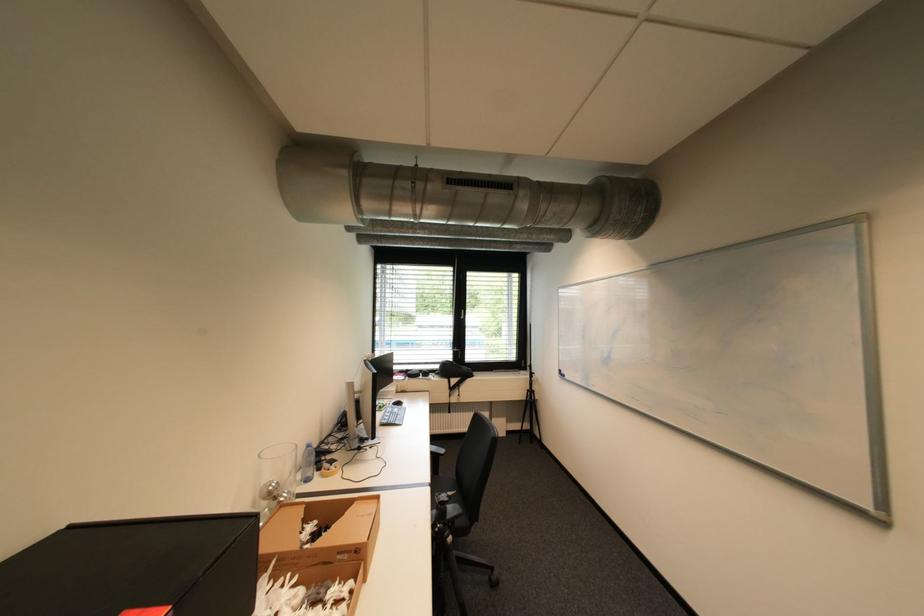
I want to click on black tripod, so click(529, 411).